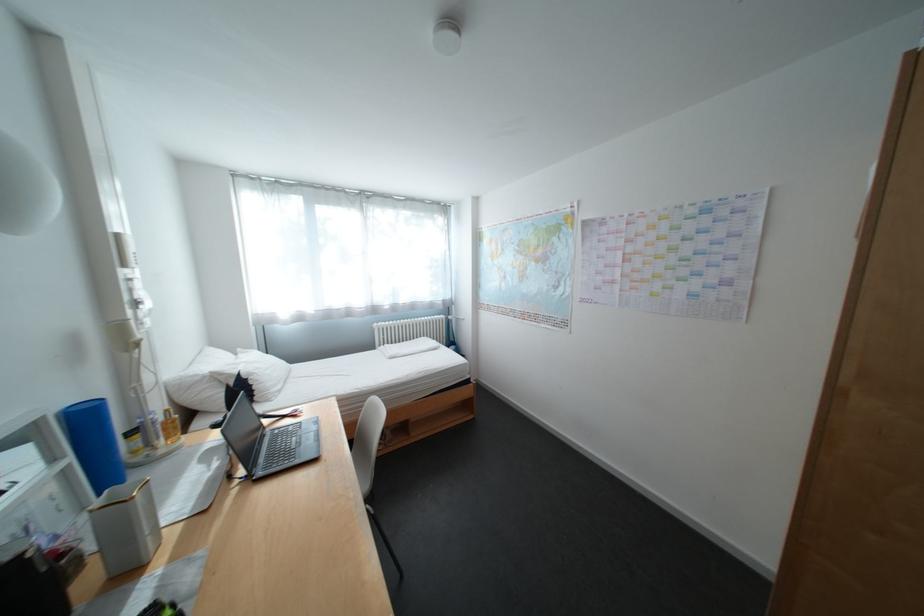
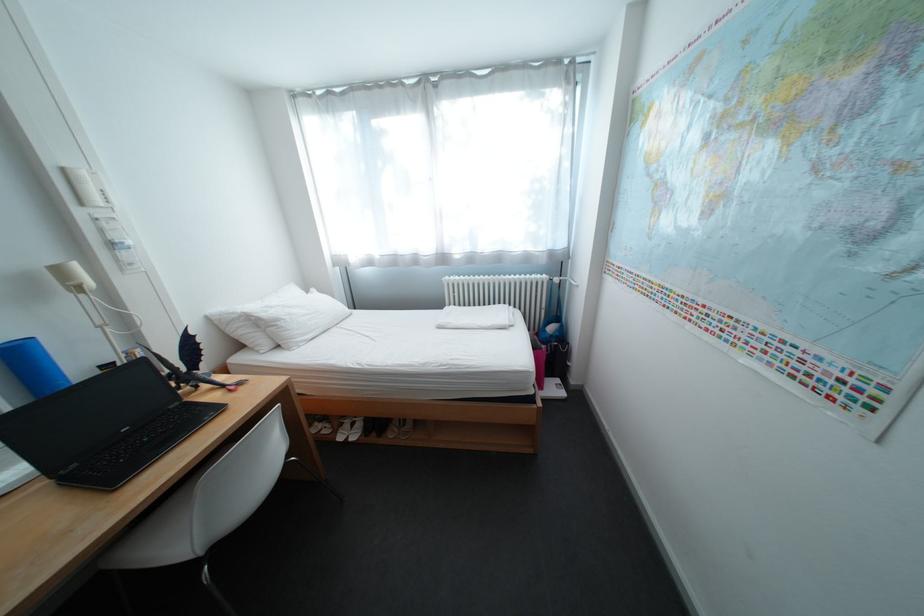
Locate, in the second image, the point that corresponds to pixel 387 325 in the first image.

(459, 278)